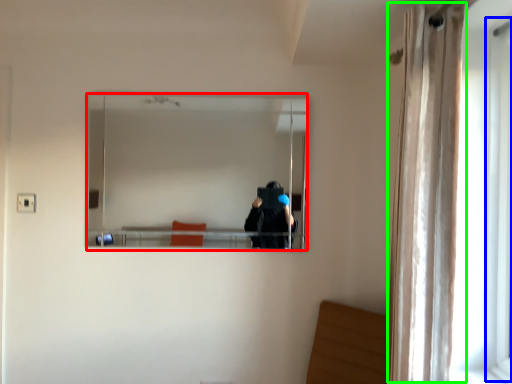
Question: Based on their relative distances, which object is farther from mirror (highlighted by a red box)? Choose from screen door (highlighted by a blue box) and curtain (highlighted by a green box).

Choices:
 (A) screen door
 (B) curtain

Answer: (A)